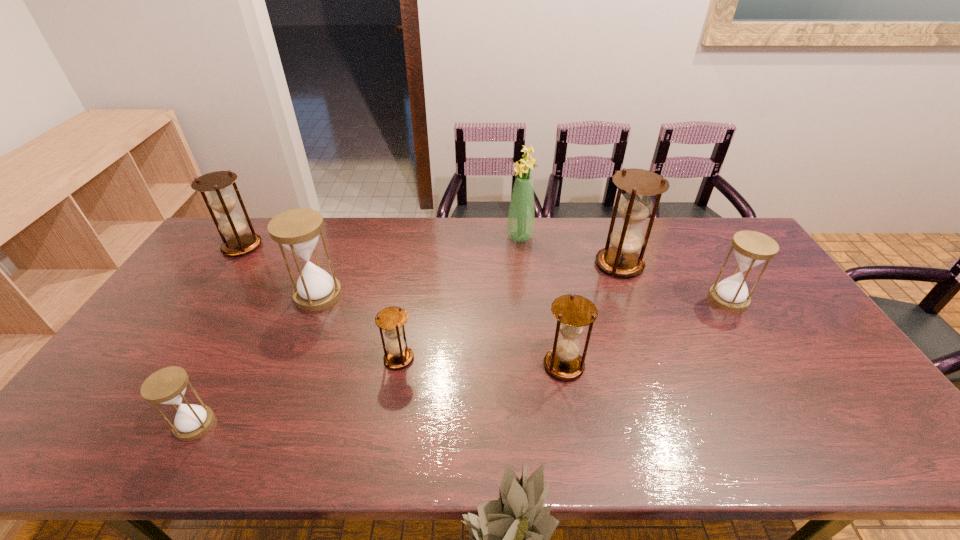
Locate an element on the screen. the second biggest white hourglass is located at coordinates (751, 248).

Identify the location of the smallest brown hourglass. (391, 319).

Where is `the third brown hourglass from right to left`? The width and height of the screenshot is (960, 540). the third brown hourglass from right to left is located at coordinates (391, 319).

Find the location of a particular element. the sixth hourglass from right to left is located at coordinates (167, 386).

Identify the location of the second object from left to right. This screenshot has height=540, width=960. (167, 386).

This screenshot has height=540, width=960. I want to click on blank area located on the front-facing side of the green bouquet, so click(446, 237).

The width and height of the screenshot is (960, 540). What are the coordinates of `vacant area situated on the front-facing side of the green bouquet` in the screenshot? It's located at (444, 237).

At what (x,y) coordinates should I click in order to perform the action: click on vacant position located on the front-facing side of the green bouquet. Please return your answer as a coordinate pair (x, y). This screenshot has width=960, height=540. Looking at the image, I should click on (396, 237).

Where is `free location located 0.180m on the left of the biggest brown hourglass`? free location located 0.180m on the left of the biggest brown hourglass is located at coordinates (541, 264).

Find the location of a particular element. Image resolution: width=960 pixels, height=540 pixels. free region located on the back of the second biggest brown hourglass is located at coordinates (260, 220).